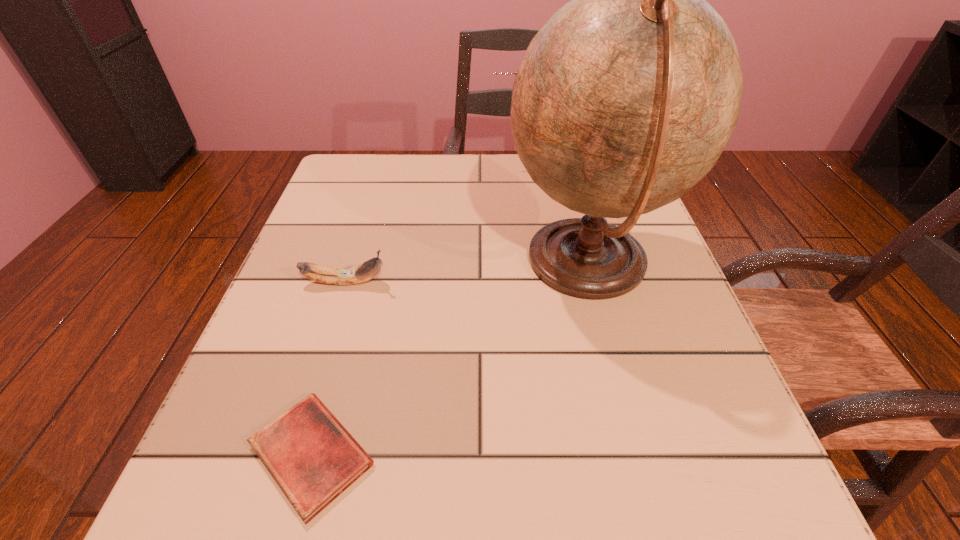
The width and height of the screenshot is (960, 540). Find the location of `object located at the near left corner`. object located at the near left corner is located at coordinates (311, 456).

This screenshot has width=960, height=540. I want to click on object present at the far right corner, so click(x=515, y=73).

Identify the location of blank space at the far edge. Image resolution: width=960 pixels, height=540 pixels. (492, 193).

This screenshot has height=540, width=960. In the image, there is a desktop. Identify the location of vacant space at the left edge. [348, 351].

In the image, there is a desktop. Where is `vacant space at the right edge`? This screenshot has width=960, height=540. vacant space at the right edge is located at coordinates (621, 314).

In the image, there is a desktop. In order to click on free region at the near left corner in this screenshot , I will do `click(226, 473)`.

Where is `free space at the near right corner`? The height and width of the screenshot is (540, 960). free space at the near right corner is located at coordinates (712, 529).

At what (x,y) coordinates should I click in order to perform the action: click on vacant space that's between the tallest object and the diary. Please return your answer as a coordinate pair (x, y). The image size is (960, 540). Looking at the image, I should click on (449, 359).

Locate an element on the screen. This screenshot has height=540, width=960. free point between the tallest object and the banana is located at coordinates (467, 273).

At what (x,y) coordinates should I click in order to perform the action: click on free space between the farthest object and the shortest object. Please return your answer as a coordinate pair (x, y). The image size is (960, 540). Looking at the image, I should click on (430, 309).